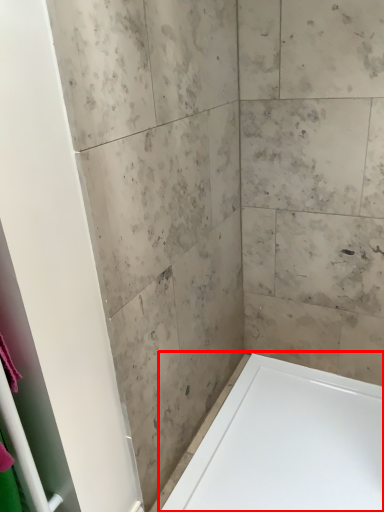
Question: From the image's perspective, what is the correct spatial positioning of bathtub (annotated by the red box) in reference to screen door?

Choices:
 (A) below
 (B) above

Answer: (A)